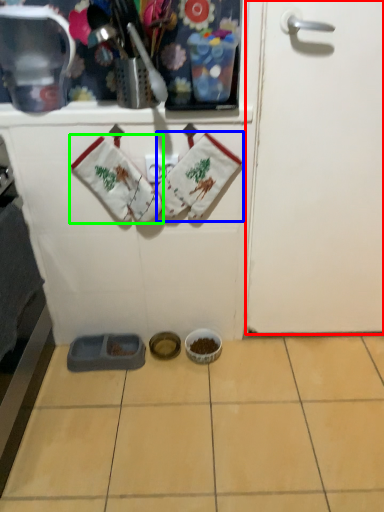
Question: Which is nearer to the door (highlighted by a red box)? baby clothe (highlighted by a blue box) or baby clothe (highlighted by a green box).

Choices:
 (A) baby clothe
 (B) baby clothe

Answer: (A)